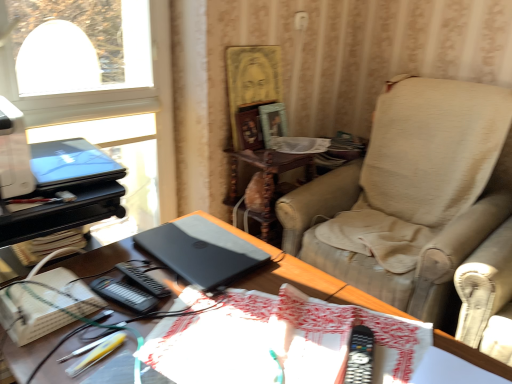
In order to click on free point in front of matte black laptop at center, which is counted as the first laptop, starting from the bottom in this screenshot , I will do `click(192, 319)`.